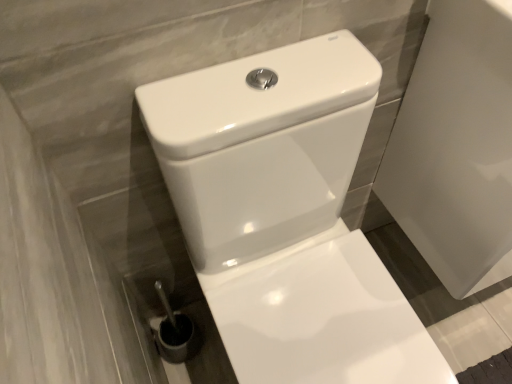
Question: Is white glossy porcelain at right bigger than white glossy toilet at center?

Choices:
 (A) no
 (B) yes

Answer: (A)

Question: Does white glossy porcelain at right have a lesser height compared to white glossy toilet at center?

Choices:
 (A) yes
 (B) no

Answer: (A)

Question: Considering the relative positions of white glossy porcelain at right and white glossy toilet at center in the image provided, is white glossy porcelain at right behind white glossy toilet at center?

Choices:
 (A) yes
 (B) no

Answer: (A)

Question: Is white glossy porcelain at right positioned far away from white glossy toilet at center?

Choices:
 (A) yes
 (B) no

Answer: (B)

Question: Is white glossy toilet at center completely or partially inside white glossy porcelain at right?

Choices:
 (A) yes
 (B) no

Answer: (B)

Question: Does white glossy porcelain at right lie in front of white glossy toilet at center?

Choices:
 (A) no
 (B) yes

Answer: (A)

Question: Considering the relative sizes of white glossy toilet at center and white glossy porcelain at right in the image provided, is white glossy toilet at center taller than white glossy porcelain at right?

Choices:
 (A) no
 (B) yes

Answer: (B)

Question: Would you consider white glossy toilet at center to be distant from white glossy porcelain at right?

Choices:
 (A) no
 (B) yes

Answer: (A)

Question: From a real-world perspective, is white glossy toilet at center positioned over white glossy porcelain at right based on gravity?

Choices:
 (A) yes
 (B) no

Answer: (B)

Question: Is white glossy toilet at center shorter than white glossy porcelain at right?

Choices:
 (A) no
 (B) yes

Answer: (A)

Question: Considering the relative sizes of white glossy toilet at center and white glossy porcelain at right in the image provided, is white glossy toilet at center smaller than white glossy porcelain at right?

Choices:
 (A) no
 (B) yes

Answer: (A)

Question: Can white glossy porcelain at right be found inside white glossy toilet at center?

Choices:
 (A) no
 (B) yes

Answer: (A)

Question: From the image's perspective, is white glossy porcelain at right located above or below white glossy toilet at center?

Choices:
 (A) below
 (B) above

Answer: (B)